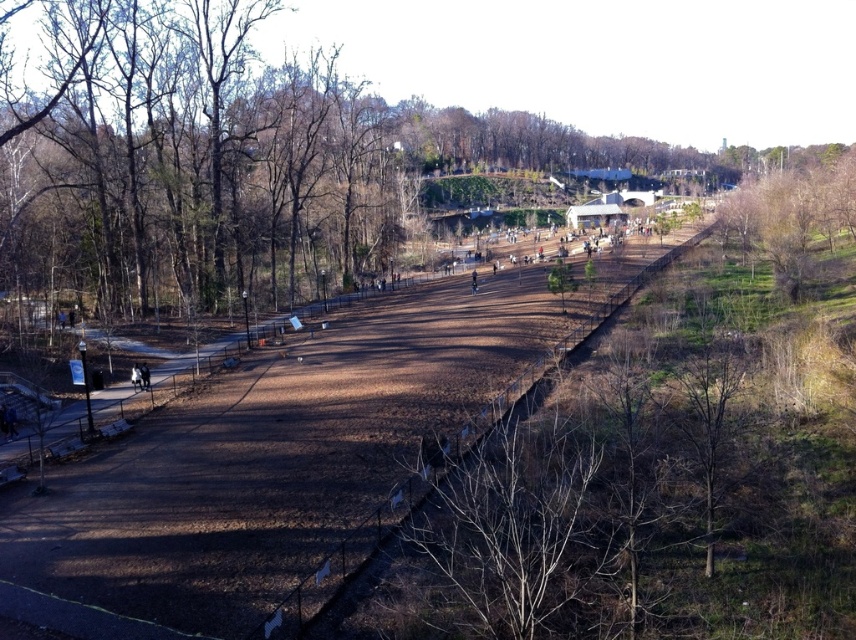
Is bare wood trees at upper left to the right of brown dirt track at center from the viewer's perspective?

Yes, bare wood trees at upper left is to the right of brown dirt track at center.

Which is above, bare wood trees at upper left or brown dirt track at center?

bare wood trees at upper left

Which is behind, point (415, 141) or point (539, 362)?

Point (415, 141)

The height and width of the screenshot is (640, 856). Find the location of `bare wood trees at upper left`. bare wood trees at upper left is located at coordinates (206, 163).

Is brown dirt track at center further to the viewer compared to bare wood tree at right?

No.

Between point (336, 436) and point (837, 173), which one is positioned behind?

The point (837, 173) is more distant.

What do you see at coordinates (277, 461) in the screenshot?
I see `brown dirt track at center` at bounding box center [277, 461].

Identify the location of brown dirt track at center. This screenshot has height=640, width=856. (277, 461).

Is bare wood trees at upper left to the left of bare wood tree at right from the viewer's perspective?

Correct, you'll find bare wood trees at upper left to the left of bare wood tree at right.

Who is lower down, bare wood trees at upper left or bare wood tree at right?

bare wood tree at right is below.

Is point (153, 316) less distant than point (833, 244)?

Yes.

Where is `bare wood trees at upper left`? bare wood trees at upper left is located at coordinates (206, 163).